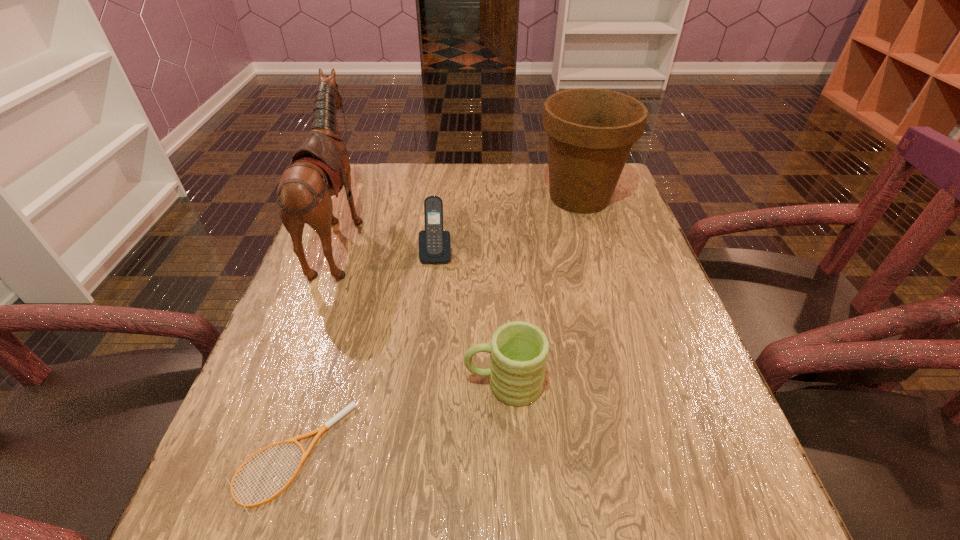
Find the location of a particular element. Image resolution: width=960 pixels, height=540 pixels. saddle is located at coordinates (320, 167).

Locate an element on the screen. flowerpot is located at coordinates (591, 131).

Locate an element on the screen. The image size is (960, 540). the rightmost object is located at coordinates 591,131.

Find the location of a particular element. Image resolution: width=960 pixels, height=540 pixels. the third shortest object is located at coordinates (434, 242).

The image size is (960, 540). What are the coordinates of `the third object from left to right` in the screenshot? It's located at (434, 242).

Where is `the second object from right to left`? The height and width of the screenshot is (540, 960). the second object from right to left is located at coordinates (518, 350).

At what (x,y) coordinates should I click in order to perform the action: click on the second shortest object. Please return your answer as a coordinate pair (x, y). The image size is (960, 540). Looking at the image, I should click on (518, 350).

The image size is (960, 540). I want to click on tennis racket, so click(352, 405).

I want to click on vacant space located on the back of the tallest object, so click(470, 234).

The width and height of the screenshot is (960, 540). I want to click on free region located on the left of the rightmost object, so click(497, 197).